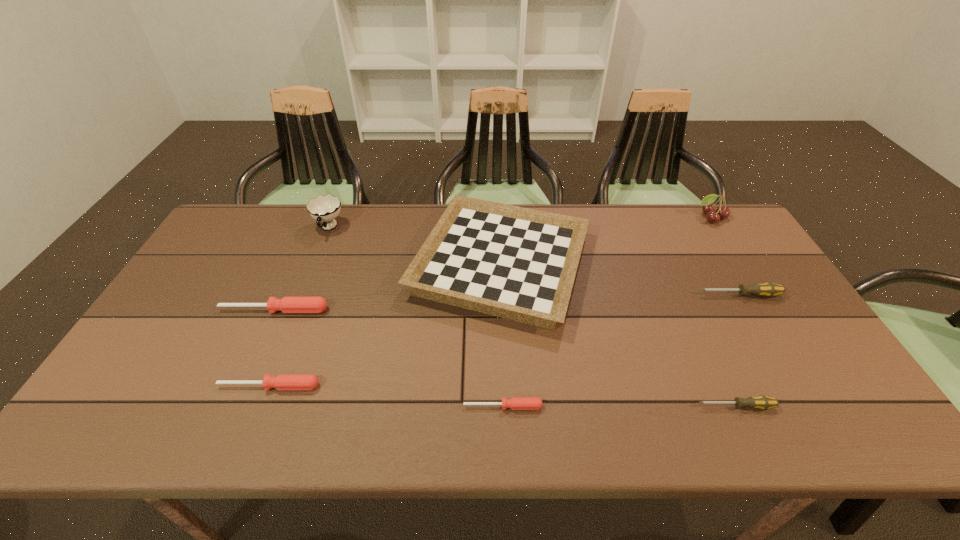
In order to click on object that is at the far right corner in this screenshot , I will do `click(708, 208)`.

Identify the location of vacant area at the far edge of the desktop. (352, 212).

Where is `vacant space at the near edge of the desktop`? vacant space at the near edge of the desktop is located at coordinates (278, 408).

In order to click on vacant region at the left edge of the desktop in this screenshot , I will do `click(206, 255)`.

In order to click on blank area at the near left corner in this screenshot , I will do `click(103, 427)`.

Locate an element on the screen. The image size is (960, 540). vacant area at the far right corner is located at coordinates (722, 230).

The image size is (960, 540). What are the coordinates of `vacant area that lies between the cherry and the farthest screwdriver` in the screenshot? It's located at (725, 256).

At what (x,y) coordinates should I click in order to perform the action: click on free spot between the sixth shortest object and the second smallest red screwdriver. Please return your answer as a coordinate pair (x, y). This screenshot has width=960, height=540. Looking at the image, I should click on (385, 325).

Find the location of a particular element. Image resolution: width=960 pixels, height=540 pixels. unoccupied area between the nearer gray screwdriver and the biggest red screwdriver is located at coordinates (505, 358).

In order to click on free point between the nearest red screwdriver and the white cup in this screenshot , I will do `click(416, 317)`.